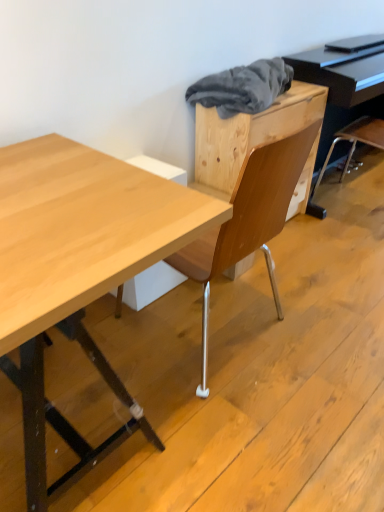
Find the location of a particular element. vacant space underneath black glossy piano at upper right (from a real-world perspective) is located at coordinates (346, 202).